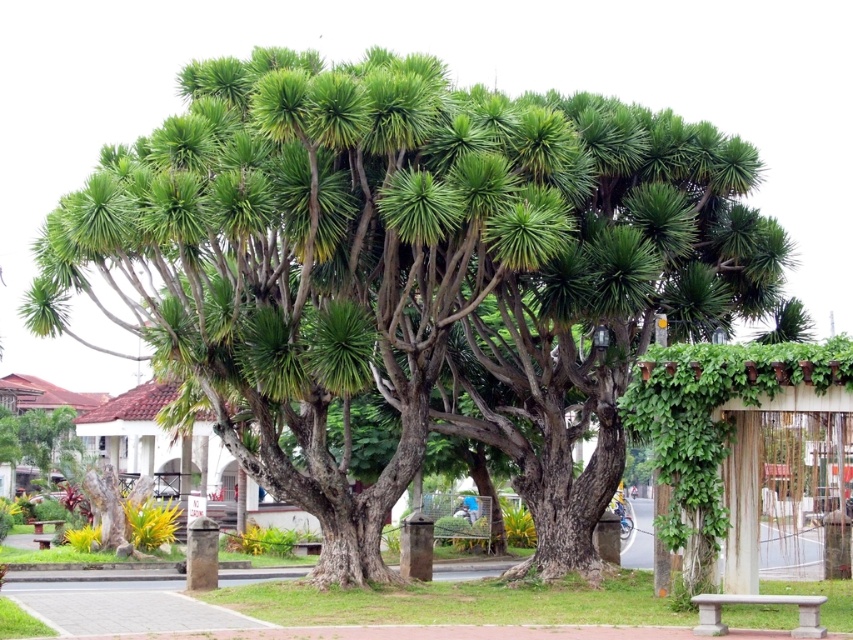
What do you see at coordinates (759, 604) in the screenshot? I see `gray concrete bench at lower right` at bounding box center [759, 604].

At what (x,y) coordinates should I click in order to perform the action: click on gray concrete bench at lower right. Please return your answer as a coordinate pair (x, y). The width and height of the screenshot is (853, 640). Looking at the image, I should click on (759, 604).